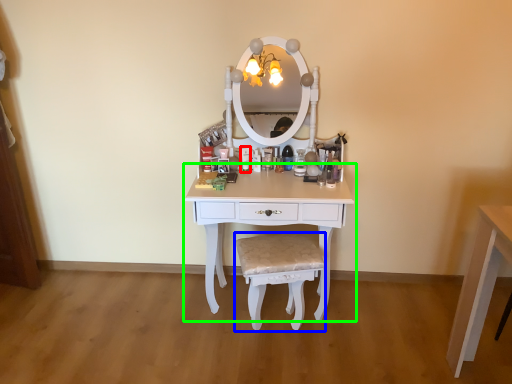
Question: Which is farther away from toiletry (highlighted by a red box)? chair (highlighted by a blue box) or table (highlighted by a green box)?

Choices:
 (A) chair
 (B) table

Answer: (A)